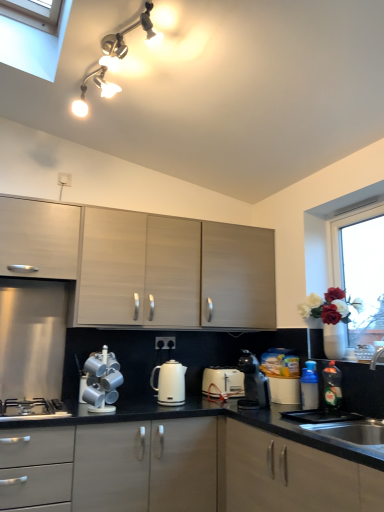
Where is `vacant area that is situated to the right of silver metallic mugs at lower center, positioned as the second appliance in back-to-front order`? Image resolution: width=384 pixels, height=512 pixels. vacant area that is situated to the right of silver metallic mugs at lower center, positioned as the second appliance in back-to-front order is located at coordinates (135, 411).